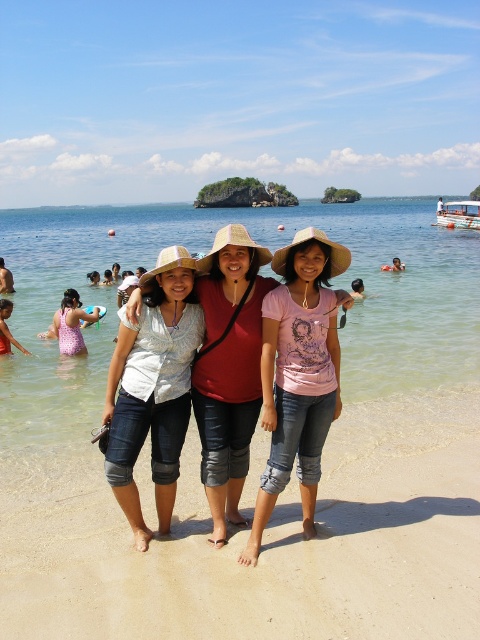
Question: Which point is farther to the camera?

Choices:
 (A) clear water at beach center
 (B) pink matte shirt at center
 (C) matte white shirt at center

Answer: (A)

Question: Does pink matte shirt at center appear over matte white shirt at center?

Choices:
 (A) no
 (B) yes

Answer: (B)

Question: Can you confirm if denim jeans at center is thinner than matte white shirt at center?

Choices:
 (A) no
 (B) yes

Answer: (A)

Question: Can you confirm if denim jeans at center is positioned to the left of matte white shirt at center?

Choices:
 (A) no
 (B) yes

Answer: (A)

Question: Based on their relative distances, which object is nearer to the matte pink shirt at center?

Choices:
 (A) pink fabric swimsuit at left
 (B) pink matte shirt at center
 (C) matte white shirt at center

Answer: (B)

Question: Considering the real-world distances, which object is closest to the denim jeans at center?

Choices:
 (A) pink matte shirt at center
 (B) clear water at beach center

Answer: (A)